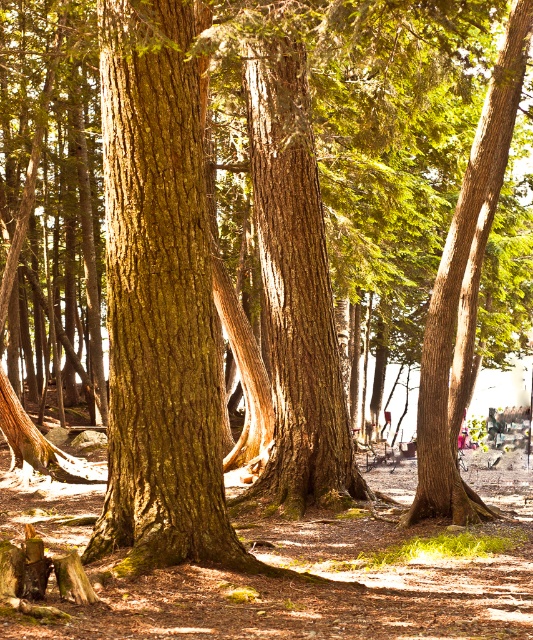
Who is lower down, brown rough bark tree trunk at center or brown rough tree trunk at center?

brown rough tree trunk at center is lower down.

Is point (263, 28) positioned after point (439, 460)?

No.

You are a GUI agent. You are given a task and a screenshot of the screen. Output one action in this format:
    pyautogui.click(x=<x>, y=<y>)
    Task: Click on the brown rough bark tree trunk at center
    The width and height of the screenshot is (533, 640).
    Given the screenshot: What is the action you would take?
    pyautogui.click(x=294, y=276)

Locate an element on the screen. brown rough bark tree trunk at center is located at coordinates (294, 276).

Can you confirm if green mossy bark tree trunk at center is positioned to the right of brown rough bark tree trunk at center?

No, green mossy bark tree trunk at center is not to the right of brown rough bark tree trunk at center.

Does green mossy bark tree trunk at center have a greater height compared to brown rough bark tree trunk at center?

Yes, green mossy bark tree trunk at center is taller than brown rough bark tree trunk at center.

Locate an element on the screen. green mossy bark tree trunk at center is located at coordinates (159, 300).

Is green mossy bark tree trunk at center to the right of brown rough tree trunk at center from the viewer's perspective?

In fact, green mossy bark tree trunk at center is to the left of brown rough tree trunk at center.

Where is `green mossy bark tree trunk at center`? green mossy bark tree trunk at center is located at coordinates (159, 300).

Which is behind, point (118, 340) or point (430, 445)?

Point (430, 445)

Where is `green mossy bark tree trunk at center`? The width and height of the screenshot is (533, 640). green mossy bark tree trunk at center is located at coordinates (159, 300).